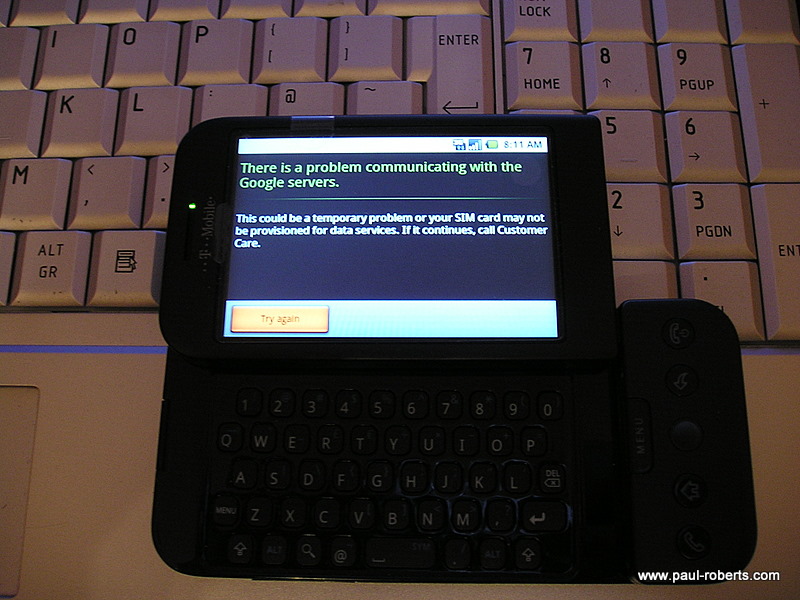
What are the coordinates of `trackpad` in the screenshot? It's located at (18, 421).